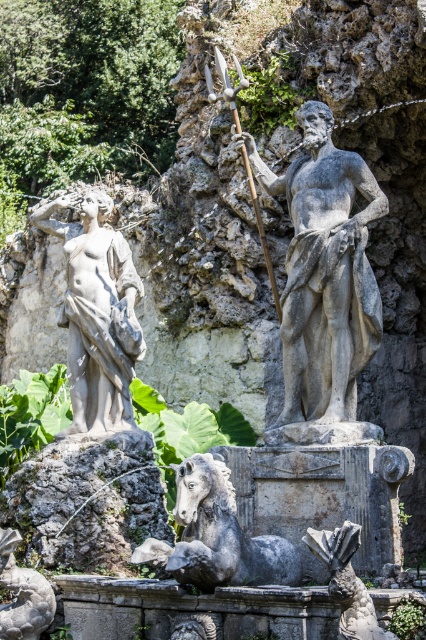
Question: Can you confirm if gray stone statue at center is positioned to the left of matte gray statue at left?

Choices:
 (A) no
 (B) yes

Answer: (A)

Question: Can you confirm if gray stone fish at lower center is positioned to the right of polished bronze spear at center?

Choices:
 (A) yes
 (B) no

Answer: (A)

Question: Which point appears farthest from the camera in this image?

Choices:
 (A) (278, 317)
 (B) (371, 212)

Answer: (A)

Question: Is the position of matte gray statue at left less distant than that of gray stone fish at lower center?

Choices:
 (A) yes
 (B) no

Answer: (B)

Question: Which of the following is the closest to the observer?

Choices:
 (A) matte gray statue at left
 (B) gray stone horse at center

Answer: (B)

Question: Which point is farther to the camera?

Choices:
 (A) polished bronze spear at center
 (B) matte gray statue at left
 (C) gray stone statue at center

Answer: (B)